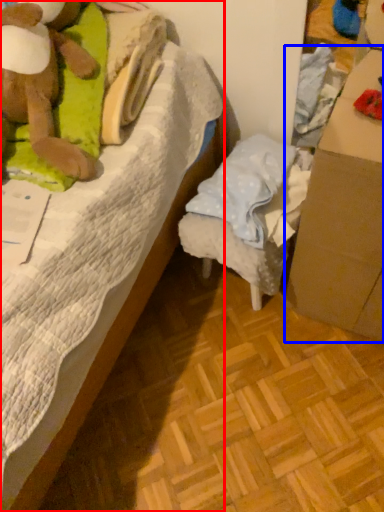
Question: Which of the following is the closest to the observer, bed (highlighted by a red box) or cardboard box (highlighted by a blue box)?

Choices:
 (A) bed
 (B) cardboard box

Answer: (A)